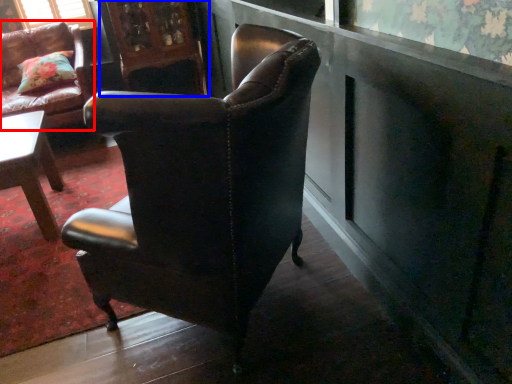
Question: Which point is closer to the camera, chair (highlighted by a red box) or armoire (highlighted by a blue box)?

Choices:
 (A) chair
 (B) armoire

Answer: (A)